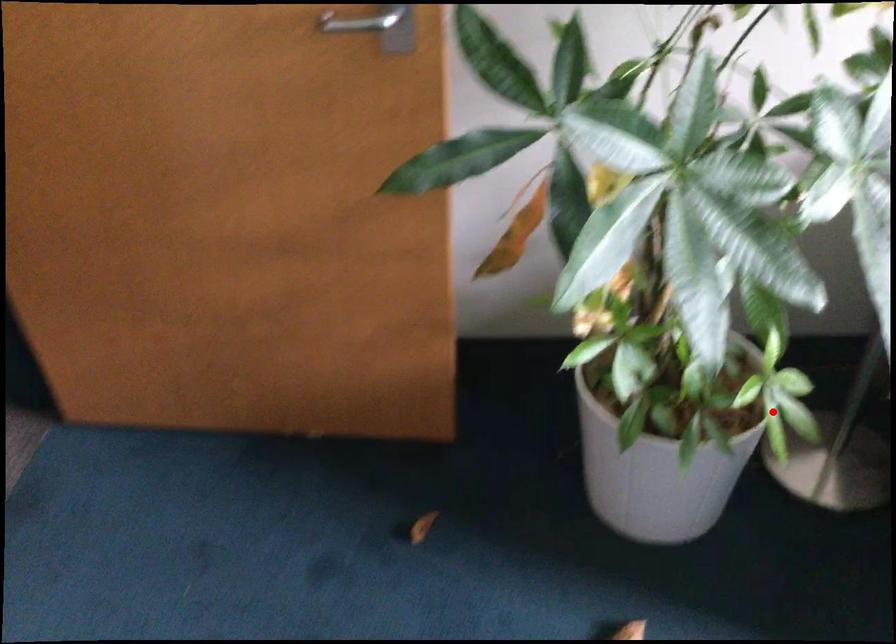
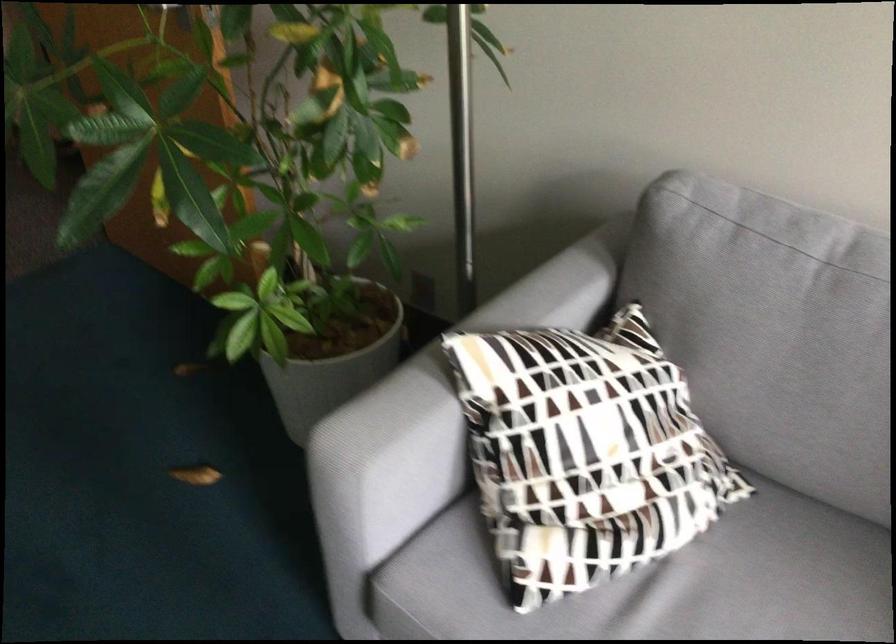
Find the pixel in the second image that matches the highlighted location in the first image.

(332, 355)